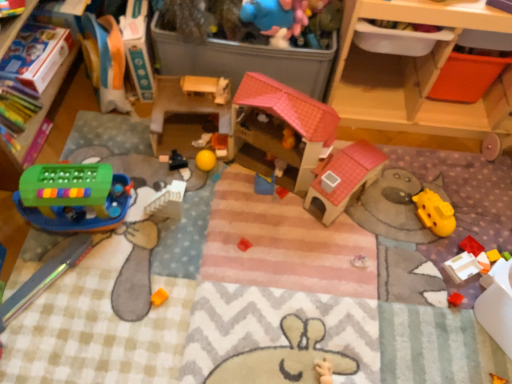
This screenshot has height=384, width=512. What do you see at coordinates (202, 140) in the screenshot?
I see `white matte figurine at center, arranged as the sixth toy when viewed from the right` at bounding box center [202, 140].

You are a GUI agent. You are given a task and a screenshot of the screen. Output one action in this format:
    pyautogui.click(x=<x>, y=<y>)
    Task: Click on the yellow rubber ball at center, which appears as the sixth toy when viewed from the left
    
    Given the screenshot: What is the action you would take?
    click(220, 144)

This screenshot has width=512, height=384. What do you see at coordinates (182, 107) in the screenshot?
I see `wooden dollhouse at center, which is counted as the 3th toy, starting from the left` at bounding box center [182, 107].

The image size is (512, 384). Describe the element at coordinates (471, 246) in the screenshot. I see `bright red plastic block at lower right, which appears as the first toy when viewed from the right` at that location.

The height and width of the screenshot is (384, 512). Find the location of `white plastic block at lower right, the 2th toy positioned from the right`. white plastic block at lower right, the 2th toy positioned from the right is located at coordinates (462, 267).

The height and width of the screenshot is (384, 512). What do you see at coordinates (177, 161) in the screenshot?
I see `metallic blue car at center, which is the 2th toy from left to right` at bounding box center [177, 161].

At what (x,y) coordinates should I click in order to perform the action: click on white matte figurine at center, arranged as the sixth toy when viewed from the right. Please return your answer as a coordinate pair (x, y). This screenshot has height=384, width=512. Looking at the image, I should click on (202, 140).

Looking at this image, what's the angular difference between yellow rubber ball at center, which is counted as the 4th toy, starting from the right, and white matte figurine at center, arranged as the sixth toy when viewed from the right,'s facing directions?

They differ by 0.00396 degrees in their facing directions.

Between yellow rubber ball at center, which appears as the sixth toy when viewed from the left, and white matte figurine at center, arranged as the sixth toy when viewed from the right, which one has more height?

yellow rubber ball at center, which appears as the sixth toy when viewed from the left.

Considering the positions of objects yellow rubber ball at center, which is counted as the 4th toy, starting from the right, and white matte figurine at center, arranged as the sixth toy when viewed from the right, in the image provided, who is in front, yellow rubber ball at center, which is counted as the 4th toy, starting from the right, or white matte figurine at center, arranged as the sixth toy when viewed from the right,?

yellow rubber ball at center, which is counted as the 4th toy, starting from the right, is closer to the camera.

Can you confirm if yellow rubber ball at center, which appears as the sixth toy when viewed from the left, is bigger than white matte figurine at center, arranged as the sixth toy when viewed from the right?

Yes, yellow rubber ball at center, which appears as the sixth toy when viewed from the left, is bigger than white matte figurine at center, arranged as the sixth toy when viewed from the right.

Find the location of a particular element. This screenshot has width=512, height=384. toy that is the 2nd one when counting backward from the yellow rubber ball at center, which is counted as the fifth toy, starting from the left is located at coordinates (220, 144).

Between yellow rubber ball at center, which is counted as the 4th toy, starting from the right, and yellow rubber ball at center, the fifth toy in the right-to-left sequence, which one has larger size?

Bigger between the two is yellow rubber ball at center, the fifth toy in the right-to-left sequence.

How much distance is there between yellow rubber ball at center, which appears as the sixth toy when viewed from the left, and yellow rubber ball at center, the fifth toy in the right-to-left sequence?

They are 1.73 inches apart.

From the image's perspective, between yellow rubber ball at center, which appears as the sixth toy when viewed from the left, and yellow rubber ball at center, the fifth toy in the right-to-left sequence, which one is located above?

yellow rubber ball at center, which appears as the sixth toy when viewed from the left.

Are wooden drawer at upper right and yellow rubber ball at center, which is counted as the 4th toy, starting from the right, making contact?

There is a gap between wooden drawer at upper right and yellow rubber ball at center, which is counted as the 4th toy, starting from the right.

Based on the photo, in terms of width, does wooden drawer at upper right look wider or thinner when compared to yellow rubber ball at center, which is counted as the 4th toy, starting from the right?

Considering their sizes, wooden drawer at upper right looks broader than yellow rubber ball at center, which is counted as the 4th toy, starting from the right.

From a real-world perspective, which object stands above the other?

From a 3D spatial view, wooden drawer at upper right is above.

Find the location of a particular element. This screenshot has height=384, width=512. shelf that appears in front of the yellow rubber ball at center, which is counted as the 4th toy, starting from the right is located at coordinates (413, 80).

Between wooden drawer at upper right and white matte figurine at center, which ranks as the 4th toy in left-to-right order, which one has more height?

Standing taller between the two is wooden drawer at upper right.

Which object is wider, wooden drawer at upper right or white matte figurine at center, which ranks as the 4th toy in left-to-right order?

wooden drawer at upper right.

What's the angular difference between wooden drawer at upper right and white matte figurine at center, which ranks as the 4th toy in left-to-right order,'s facing directions?

There is a 6.35-degree angle between the facing directions of wooden drawer at upper right and white matte figurine at center, which ranks as the 4th toy in left-to-right order.

From the image's perspective, would you say wooden drawer at upper right is positioned over white matte figurine at center, arranged as the sixth toy when viewed from the right?

Yes, from the image's perspective, wooden drawer at upper right is on top of white matte figurine at center, arranged as the sixth toy when viewed from the right.

Between wooden dollhouse at center, which is counted as the seventh toy, starting from the right, and white matte figurine at center, which ranks as the 4th toy in left-to-right order, which one has smaller size?

Smaller between the two is white matte figurine at center, which ranks as the 4th toy in left-to-right order.

Considering the positions of objects wooden dollhouse at center, which is counted as the seventh toy, starting from the right, and white matte figurine at center, arranged as the sixth toy when viewed from the right, in the image provided, who is more to the left, wooden dollhouse at center, which is counted as the seventh toy, starting from the right, or white matte figurine at center, arranged as the sixth toy when viewed from the right,?

Positioned to the left is wooden dollhouse at center, which is counted as the seventh toy, starting from the right.

Does wooden dollhouse at center, which is counted as the 3th toy, starting from the left, turn towards white matte figurine at center, which ranks as the 4th toy in left-to-right order?

Yes, wooden dollhouse at center, which is counted as the 3th toy, starting from the left, is aimed at white matte figurine at center, which ranks as the 4th toy in left-to-right order.

From a real-world perspective, is wooden dollhouse at center, which is counted as the seventh toy, starting from the right, positioned above or below green plastic boat at left, the 1th toy viewed from the left?

From a real-world perspective, wooden dollhouse at center, which is counted as the seventh toy, starting from the right, is physically below green plastic boat at left, the 1th toy viewed from the left.

Is wooden dollhouse at center, which is counted as the 3th toy, starting from the left, shorter than green plastic boat at left, the ninth toy viewed from the right?

No.

From the image's perspective, is wooden dollhouse at center, which is counted as the seventh toy, starting from the right, below green plastic boat at left, the ninth toy viewed from the right?

No, from the image's perspective, wooden dollhouse at center, which is counted as the seventh toy, starting from the right, is not below green plastic boat at left, the ninth toy viewed from the right.

How distant is wooden dollhouse at center, which is counted as the seventh toy, starting from the right, from green plastic boat at left, the ninth toy viewed from the right?

A distance of 12.86 inches exists between wooden dollhouse at center, which is counted as the seventh toy, starting from the right, and green plastic boat at left, the ninth toy viewed from the right.

Is wooden drawer at upper right wider or thinner than yellow plastic spoon at center, marked as the 3th toy in a right-to-left arrangement?

Considering their sizes, wooden drawer at upper right looks broader than yellow plastic spoon at center, marked as the 3th toy in a right-to-left arrangement.

Are wooden drawer at upper right and yellow plastic spoon at center, the 7th toy when ordered from left to right, making contact?

No, wooden drawer at upper right is not in contact with yellow plastic spoon at center, the 7th toy when ordered from left to right.

From the image's perspective, relative to yellow plastic spoon at center, marked as the 3th toy in a right-to-left arrangement, is wooden drawer at upper right above or below?

wooden drawer at upper right is situated higher than yellow plastic spoon at center, marked as the 3th toy in a right-to-left arrangement, in the image.

Which object is positioned more to the left, wooden drawer at upper right or yellow plastic spoon at center, the 7th toy when ordered from left to right?

yellow plastic spoon at center, the 7th toy when ordered from left to right.

Identify the location of toy that is the 1st one when counting forward from the white matte figurine at center, arranged as the sixth toy when viewed from the right. This screenshot has width=512, height=384. [x=220, y=144].

From a real-world perspective, starting from the yellow rubber ball at center, which appears as the sixth toy when viewed from the left, which toy is the 3rd one vertically above it? Please provide its 2D coordinates.

[(205, 160)]

Considering their positions, is yellow rubber ball at center, the fifth toy in the right-to-left sequence, positioned closer to wooden drawer at upper right than bright red plastic block at lower right, which appears as the first toy when viewed from the right?

bright red plastic block at lower right, which appears as the first toy when viewed from the right, lies closer to wooden drawer at upper right than the other object.

When comparing their distances from yellow plastic spoon at center, marked as the 3th toy in a right-to-left arrangement, does wooden dollhouse at center, which is counted as the seventh toy, starting from the right, or yellow rubber ball at center, the fifth toy in the right-to-left sequence, seem further?

wooden dollhouse at center, which is counted as the seventh toy, starting from the right, lies further to yellow plastic spoon at center, marked as the 3th toy in a right-to-left arrangement, than the other object.

Based on their spatial positions, is green plastic boat at left, the 1th toy viewed from the left, or yellow plastic spoon at center, the 7th toy when ordered from left to right, closer to white plastic block at lower right, acting as the eighth toy starting from the left?

yellow plastic spoon at center, the 7th toy when ordered from left to right, is closer to white plastic block at lower right, acting as the eighth toy starting from the left.

When comparing their distances from wooden drawer at upper right, does wooden dollhouse at center, which is counted as the 3th toy, starting from the left, or bright red plastic block at lower right, the ninth toy positioned from the left, seem further?

wooden dollhouse at center, which is counted as the 3th toy, starting from the left.

When comparing their distances from white matte figurine at center, arranged as the sixth toy when viewed from the right, does metallic blue car at center, which is the 2th toy from left to right, or yellow rubber ball at center, the fifth toy in the right-to-left sequence, seem closer?

Among the two, yellow rubber ball at center, the fifth toy in the right-to-left sequence, is located nearer to white matte figurine at center, arranged as the sixth toy when viewed from the right.

Based on the photo, based on their spatial positions, is yellow rubber ball at center, the fifth toy in the right-to-left sequence, or green plastic boat at left, the 1th toy viewed from the left, further from wooden drawer at upper right?

green plastic boat at left, the 1th toy viewed from the left, is further to wooden drawer at upper right.

Considering their positions, is white matte figurine at center, which ranks as the 4th toy in left-to-right order, positioned further to wooden drawer at upper right than wooden dollhouse at center, which is counted as the 3th toy, starting from the left?

white matte figurine at center, which ranks as the 4th toy in left-to-right order, is further to wooden drawer at upper right.

From the image, which object appears to be farther from bright red plastic block at lower right, which appears as the first toy when viewed from the right, yellow plastic spoon at center, marked as the 3th toy in a right-to-left arrangement, or white plastic block at lower right, the 2th toy positioned from the right?

yellow plastic spoon at center, marked as the 3th toy in a right-to-left arrangement, is further to bright red plastic block at lower right, which appears as the first toy when viewed from the right.

The image size is (512, 384). I want to click on toy between yellow rubber ball at center, which appears as the sixth toy when viewed from the left, and white plastic block at lower right, the 2th toy positioned from the right, from left to right, so click(x=264, y=184).

This screenshot has width=512, height=384. I want to click on toy between yellow plastic spoon at center, marked as the 3th toy in a right-to-left arrangement, and bright red plastic block at lower right, the ninth toy positioned from the left, in the horizontal direction, so click(x=462, y=267).

I want to click on toy situated between green plastic boat at left, the 1th toy viewed from the left, and wooden dollhouse at center, which is counted as the 3th toy, starting from the left, from left to right, so click(x=177, y=161).

Locate an element on the screen. toy situated between yellow rubber ball at center, the fifth toy in the right-to-left sequence, and yellow plastic spoon at center, marked as the 3th toy in a right-to-left arrangement, from left to right is located at coordinates (220, 144).